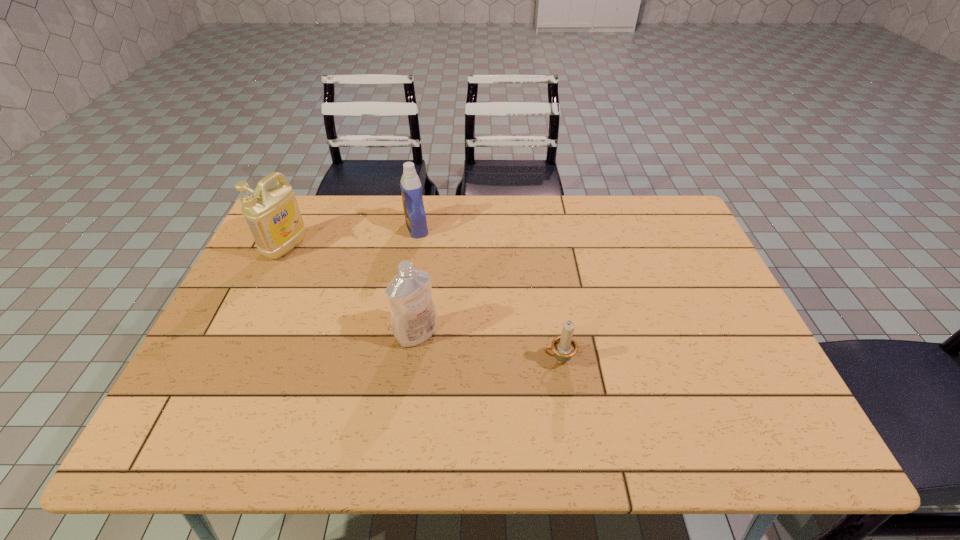
Where is `free space between the shortest object and the nearest detergent`? free space between the shortest object and the nearest detergent is located at coordinates (488, 347).

Locate an element on the screen. free space that is in between the rightmost object and the nearest detergent is located at coordinates (488, 347).

At what (x,y) coordinates should I click in order to perform the action: click on object that is the closest to the leftmost detergent. Please return your answer as a coordinate pair (x, y). Looking at the image, I should click on (411, 189).

You are a GUI agent. You are given a task and a screenshot of the screen. Output one action in this format:
    pyautogui.click(x=<x>, y=<y>)
    Task: Click on the object that stands as the closest to the nearest detergent
    
    Given the screenshot: What is the action you would take?
    pyautogui.click(x=564, y=347)

Choose which detergent is the nearest neighbor to the shortest object. Please provide its 2D coordinates. Your answer should be formatted as a tuple, i.e. [(x, y)], where the tuple contains the x and y coordinates of a point satisfying the conditions above.

[(414, 320)]

Choose which detergent is the second nearest neighbor to the leftmost detergent. Please provide its 2D coordinates. Your answer should be formatted as a tuple, i.e. [(x, y)], where the tuple contains the x and y coordinates of a point satisfying the conditions above.

[(414, 320)]